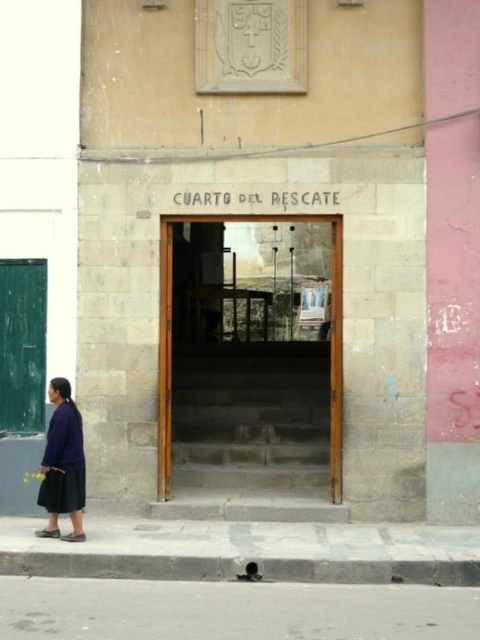
You are standing on the gray concrete pavement at lower center and want to walk towards the dark blue fabric skirt at lower left. Is the skirt in front of or behind you?

The gray concrete pavement at lower center is in front of the dark blue fabric skirt at lower left, so the skirt is behind you.

You are standing at the entrance of the building with the wooden doors. You want to walk straight ahead to the gray concrete pavement at lower center. What coordinates should you aim for?

You should aim for the coordinates point at (231, 611) to reach the gray concrete pavement at lower center.

You are a delivery person trying to reach the entrance of the building. You see the stone steps at center and the dark blue fabric skirt at lower left. Which object is closer to the entrance?

The stone steps at center is positioned over dark blue fabric skirt at lower left, so the stone steps at center is closer to the entrance.